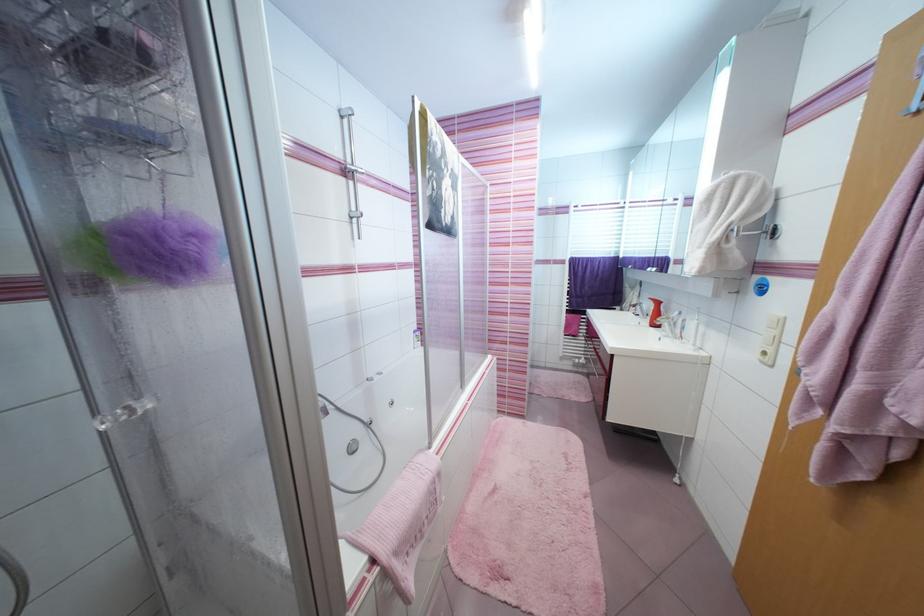
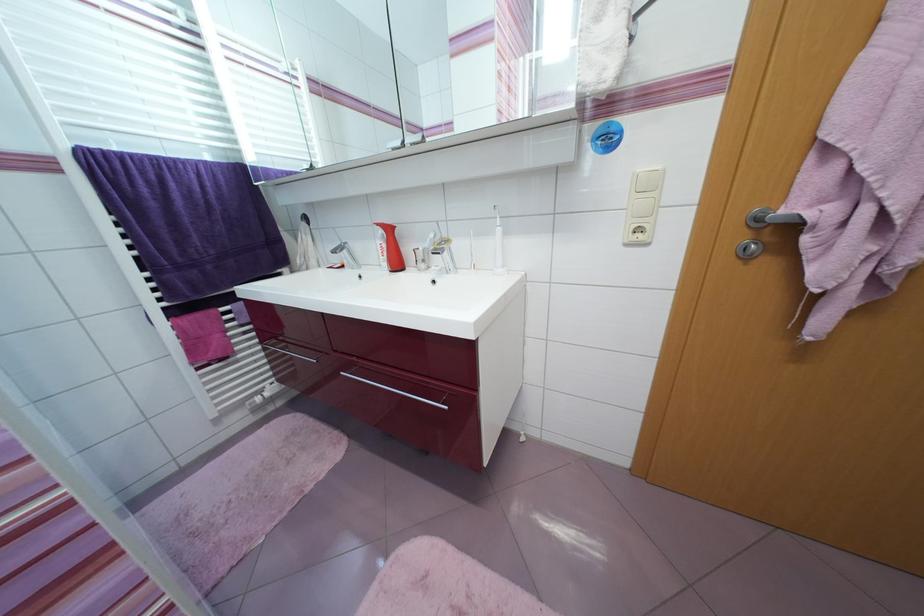
In the second image, find the point that corresponds to (663,304) in the first image.

(394, 231)